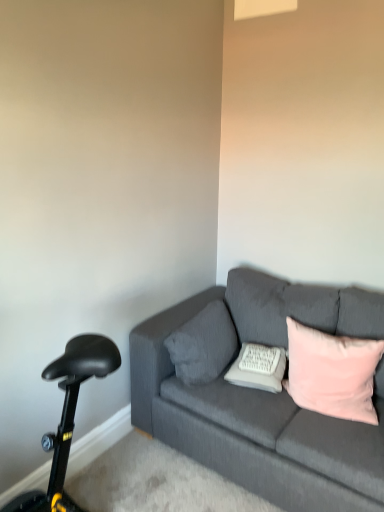
Question: From the image's perspective, is black plastic bicycle at lower left located above or below white textured pillow at center, the second pillow when ordered from right to left?

Choices:
 (A) above
 (B) below

Answer: (B)

Question: Considering the positions of black plastic bicycle at lower left and white textured pillow at center, the second pillow positioned from the left, in the image, is black plastic bicycle at lower left wider or thinner than white textured pillow at center, the second pillow positioned from the left,?

Choices:
 (A) thin
 (B) wide

Answer: (A)

Question: Which object is the farthest from the black plastic bicycle at lower left?

Choices:
 (A) textured gray pillow at center, which is counted as the 3th pillow, starting from the right
 (B) pink velvet pillow at right, marked as the first pillow in a right-to-left arrangement
 (C) white textured pillow at center, the second pillow when ordered from right to left
 (D) dark gray fabric couch at center

Answer: (B)

Question: Considering the real-world distances, which object is closest to the textured gray pillow at center, which is counted as the 3th pillow, starting from the right?

Choices:
 (A) white textured pillow at center, the second pillow positioned from the left
 (B) black plastic bicycle at lower left
 (C) pink velvet pillow at right, marked as the first pillow in a right-to-left arrangement
 (D) dark gray fabric couch at center

Answer: (A)